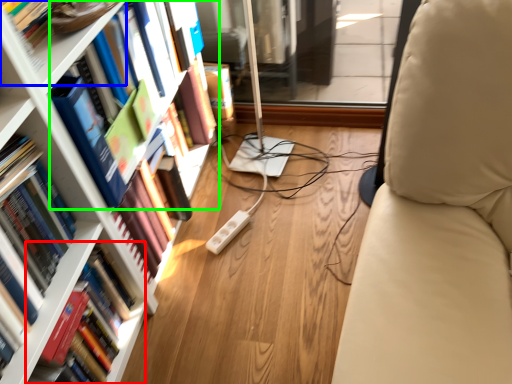
Question: Which object is the closest to the book (highlighted by a red box)? Choose among these: shelf (highlighted by a blue box) or book (highlighted by a green box).

Choices:
 (A) shelf
 (B) book

Answer: (B)